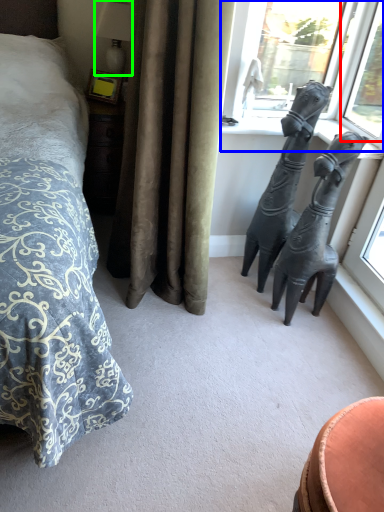
Question: Estimate the real-world distances between objects in this image. Which object is closer to window (highlighted by a red box), window (highlighted by a blue box) or lamp (highlighted by a green box)?

Choices:
 (A) window
 (B) lamp

Answer: (A)